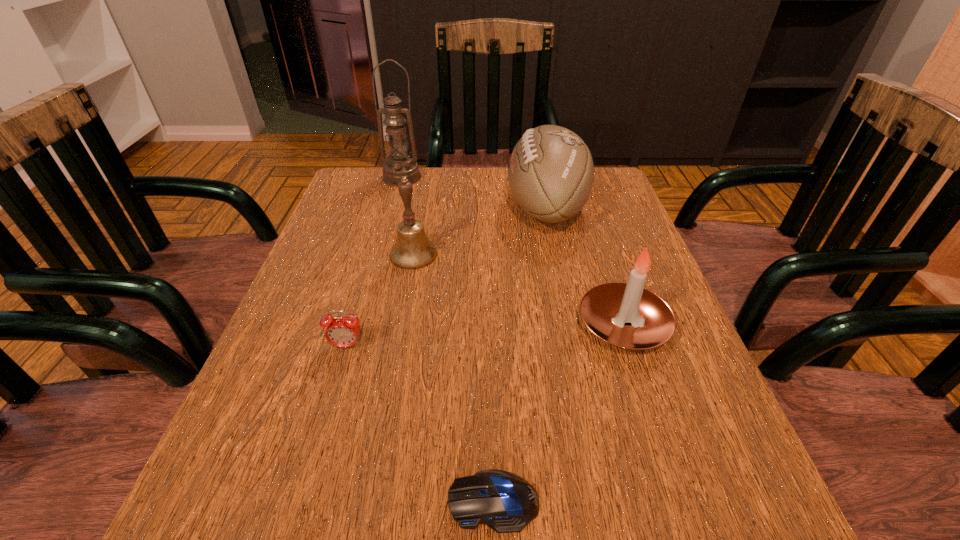
Locate an element on the screen. the tallest object is located at coordinates (400, 165).

Image resolution: width=960 pixels, height=540 pixels. Find the location of `football (American)`. football (American) is located at coordinates (551, 172).

You are a GUI agent. You are given a task and a screenshot of the screen. Output one action in this format:
    pyautogui.click(x=<x>, y=<y>)
    Task: Click on the bell
    The width and height of the screenshot is (960, 540).
    Given the screenshot: What is the action you would take?
    pyautogui.click(x=412, y=250)

At what (x,y) coordinates should I click in order to perform the action: click on candle. Please return your answer as a coordinate pair (x, y). This screenshot has height=540, width=960. Looking at the image, I should click on (605, 308).

The image size is (960, 540). Find the location of `alarm clock`. alarm clock is located at coordinates (341, 331).

Find the location of `computer mouse`. computer mouse is located at coordinates (505, 502).

Locate an element on the screen. This screenshot has width=960, height=540. the shortest object is located at coordinates (505, 502).

In order to click on vacant space located on the right of the oil lamp in this screenshot , I will do tap(443, 177).

Find the location of `vacant space located on the laces of the football (American)`. vacant space located on the laces of the football (American) is located at coordinates (462, 208).

Where is `vacant space situated 0.160m on the laces of the football (American)`? vacant space situated 0.160m on the laces of the football (American) is located at coordinates (442, 208).